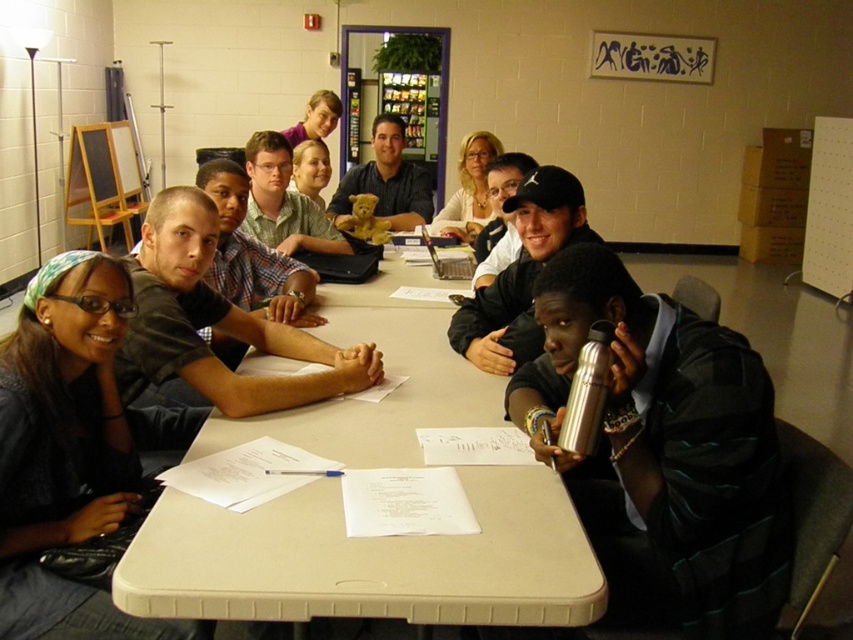
You are a photographer trying to capture a candid shot of the matte white blouse at upper center without including the beige plastic table at center in the frame. Based on their positions, is this possible?

The beige plastic table at center is below the matte white blouse at upper center, so it is possible to frame the shot to exclude the table while capturing the blouse.

You are a person sitting at the beige plastic table at center and want to place the smooth beige teddy bear at center on the table. Can you do that without the teddy bear touching the ground?

The beige plastic table at center is taller than smooth beige teddy bear at center, so yes, you can place the smooth beige teddy bear at center on the table without it touching the ground since the table is higher than the teddy bear.